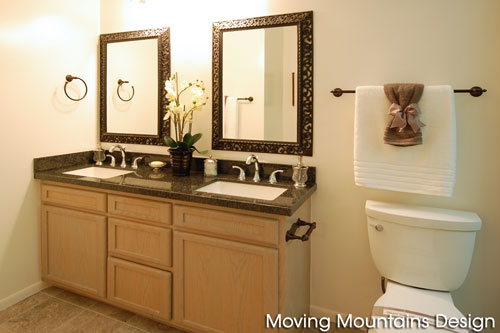
This screenshot has width=500, height=333. Identify the location of flush handle. (376, 228).